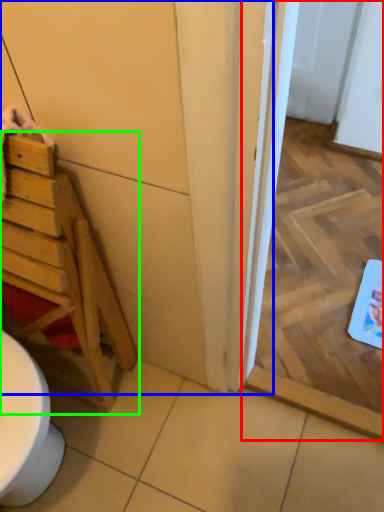
Question: Which object is the farthest from screen door (highlighted by a red box)? Choose among these: door (highlighted by a blue box) or furniture (highlighted by a green box).

Choices:
 (A) door
 (B) furniture

Answer: (B)